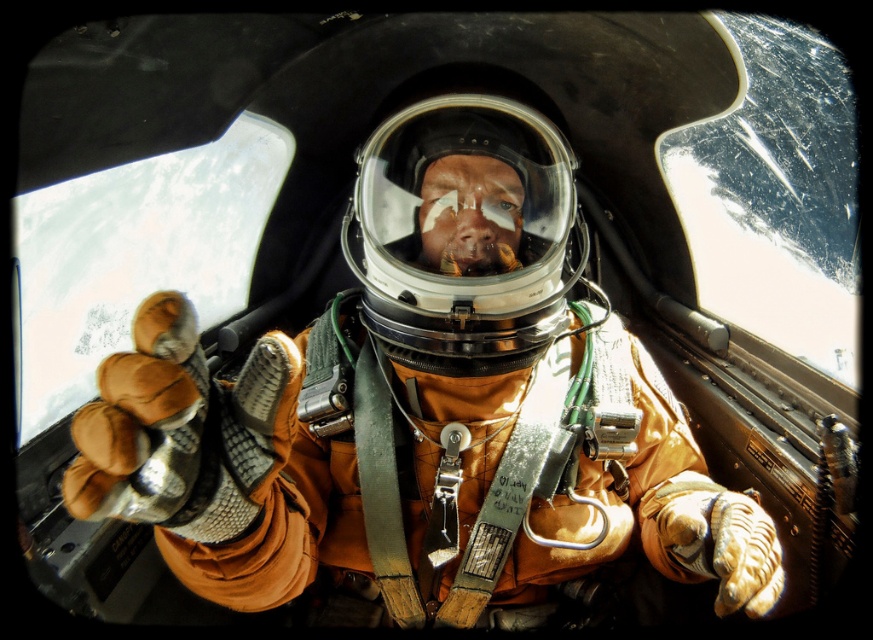
You are an astronaut preparing for a spacewalk. You notice the orange fabric astronaut at center and the transparent plastic helmet at center in your spacecraft. Which object would you need to adjust if you want to increase the visibility of your face during the spacewalk?

You would need to adjust the transparent plastic helmet at center because it is positioned closer to your face and is the transparent part that covers the head, allowing for visibility adjustments.

You are an astronaut preparing for a spacewalk. You need to ensure your equipment fits properly. Based on the scene, which object is wider, the orange fabric astronaut at center or the transparent plastic helmet at center?

The orange fabric astronaut at center is wider than the transparent plastic helmet at center according to the description.

You are an astronaut preparing for a spacewalk. You notice the orange fabric astronaut at center and the transparent plastic helmet at center in your spacecraft. Which object is closer to you?

The orange fabric astronaut at center is closer to the viewer than the transparent plastic helmet at center.